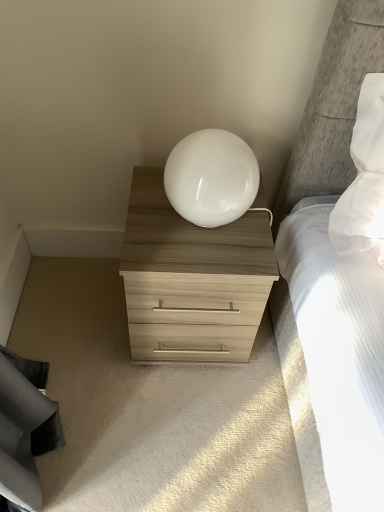
Identify the location of blank space situated above light wood/texture chest of drawers at center (from a real-world perspective). (188, 230).